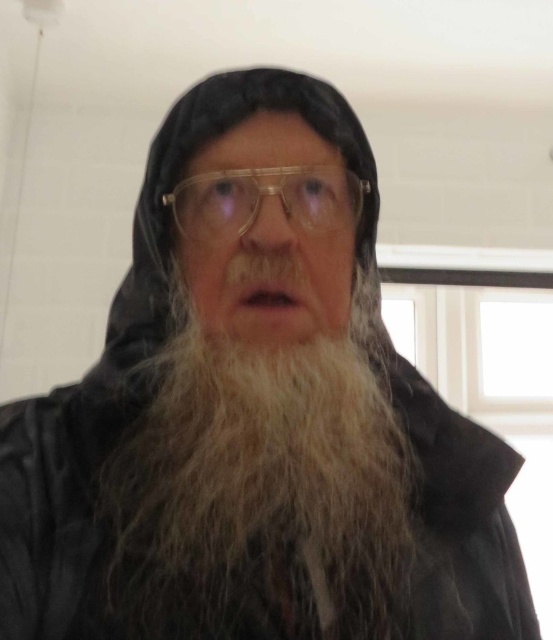
Can you confirm if white fuzzy beard at center is bigger than transparent plastic glasses at center?

Indeed, white fuzzy beard at center has a larger size compared to transparent plastic glasses at center.

Does white fuzzy beard at center have a smaller size compared to transparent plastic glasses at center?

Incorrect, white fuzzy beard at center is not smaller in size than transparent plastic glasses at center.

Who is more distant from viewer, (221, 428) or (176, 224)?

Point (176, 224)

Locate an element on the screen. The height and width of the screenshot is (640, 553). white fuzzy beard at center is located at coordinates (263, 488).